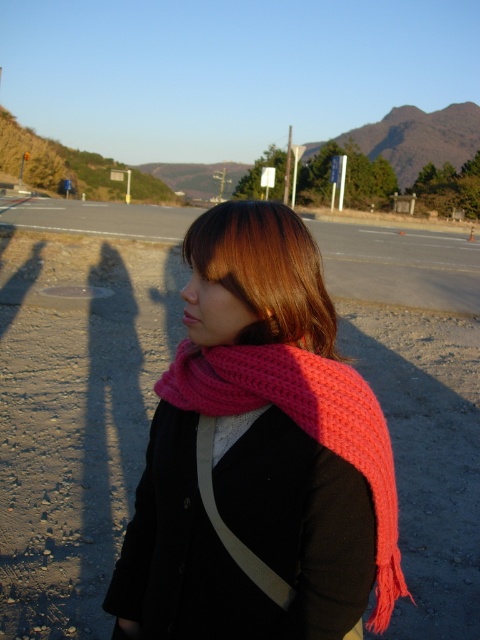
Question: Considering the relative positions of pink knitted scarf at center and brownwoollyhair at center in the image provided, where is pink knitted scarf at center located with respect to brownwoollyhair at center?

Choices:
 (A) left
 (B) right

Answer: (B)

Question: Among these objects, which one is farthest from the camera?

Choices:
 (A) pink knitted scarf at center
 (B) brownwoollyhair at center

Answer: (B)

Question: Which point appears closest to the camera in this image?

Choices:
 (A) (233, 353)
 (B) (284, 224)

Answer: (B)

Question: Considering the relative positions of pink knitted scarf at center and brownwoollyhair at center in the image provided, where is pink knitted scarf at center located with respect to brownwoollyhair at center?

Choices:
 (A) below
 (B) above

Answer: (A)

Question: Observing the image, what is the correct spatial positioning of pink knitted scarf at center in reference to brownwoollyhair at center?

Choices:
 (A) left
 (B) right

Answer: (B)

Question: Which of the following is the farthest from the observer?

Choices:
 (A) (196, 349)
 (B) (312, 323)

Answer: (A)